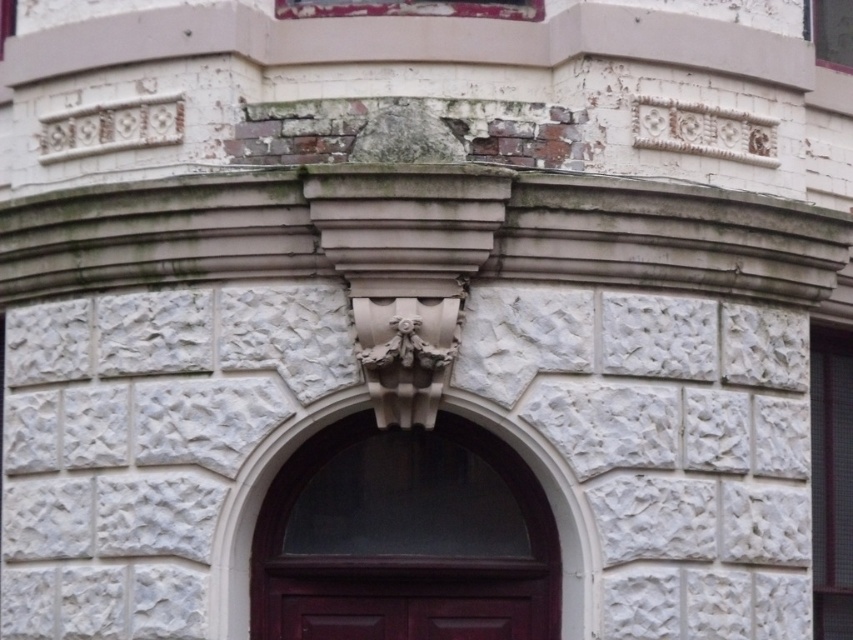
Which is behind, point (305, 589) or point (842, 412)?

The point (842, 412) is more distant.

This screenshot has width=853, height=640. What do you see at coordinates (404, 538) in the screenshot? I see `dark wood door at center` at bounding box center [404, 538].

Does point (354, 465) come behind point (822, 589)?

No, (354, 465) is in front of (822, 589).

Where is `dark wood door at center`? The image size is (853, 640). dark wood door at center is located at coordinates (404, 538).